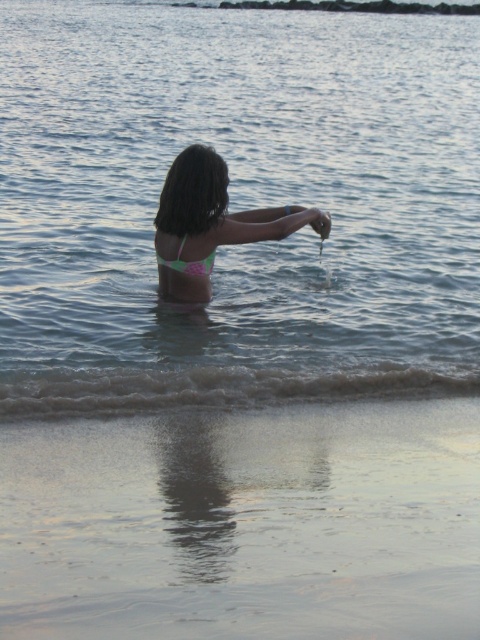
In the scene shown: You are a photographer trying to capture the perfect shot of the pink bikini at center and the smooth skin hand at upper center. Based on their sizes, which object should you focus on first to ensure it is in sharp focus?

The pink bikini at center is bigger than the smooth skin hand at upper center, so you should focus on the pink bikini at center first to ensure it is in sharp focus since larger objects are easier to focus on.

You are a photographer trying to capture the scene from the camera position. The smooth sand at lower center and the smooth skin hand at upper center are both in your view. Which object is positioned higher in the frame?

The smooth skin hand at upper center is positioned higher in the frame than the smooth sand at lower center because the smooth sand at lower center is much taller as smooth skin hand at upper center.

You are a photographer trying to capture the perfect shot of the pink bikini at center and the smooth skin hand at upper center. Since you want to highlight both elements, which object should you focus on first to ensure proper depth of field?

The pink bikini at center should be focused on first because it has a greater height compared to the smooth skin hand at upper center, ensuring both are in focus when using depth of field techniques.